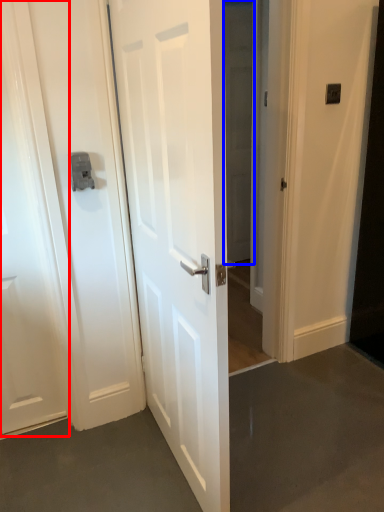
Question: Which object is further to the camera taking this photo, door (highlighted by a red box) or glass door (highlighted by a blue box)?

Choices:
 (A) door
 (B) glass door

Answer: (B)